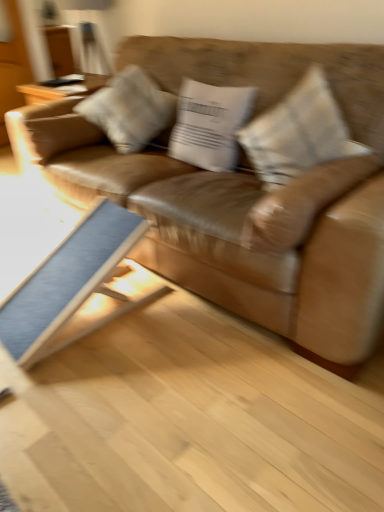
At what (x,y) coordinates should I click in order to perform the action: click on vacant space in front of blue fabric table at lower left. Please return your answer as a coordinate pair (x, y). Looking at the image, I should click on [91, 396].